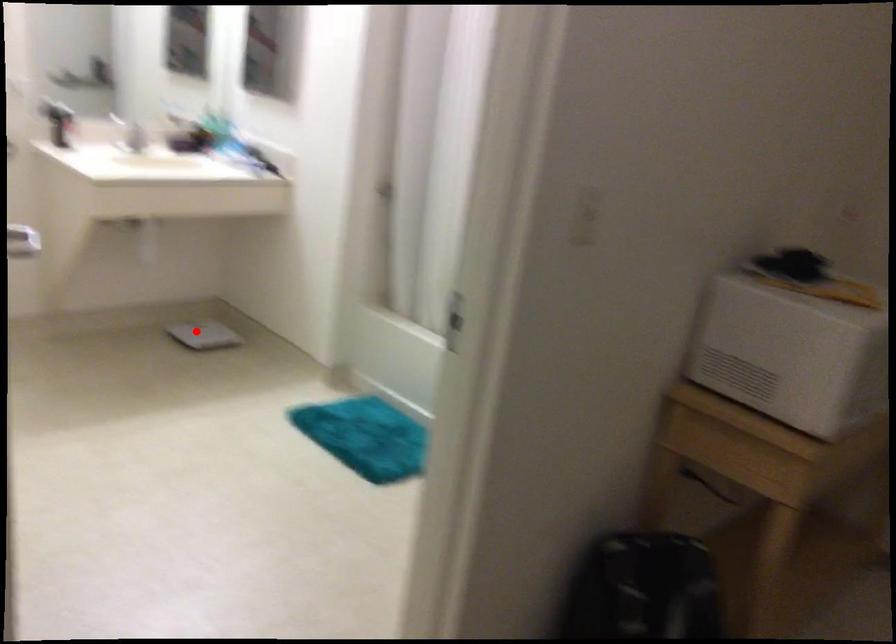
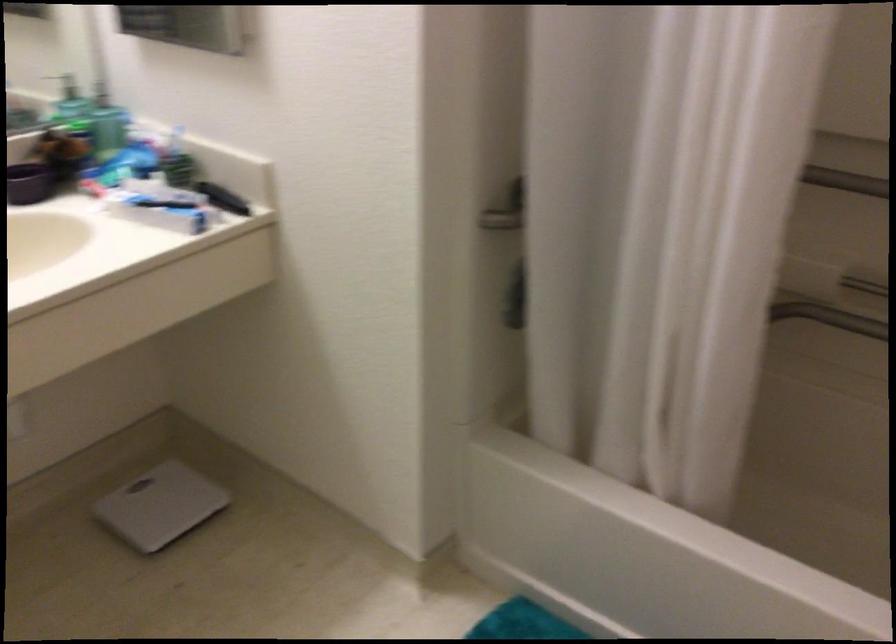
Question: I am providing you with two images of the same scene from different viewpoints. In image1, a red point is highlighted. Considering the same 3D point in image2, which of the following is correct?

Choices:
 (A) It is closer
 (B) It is farther

Answer: (A)